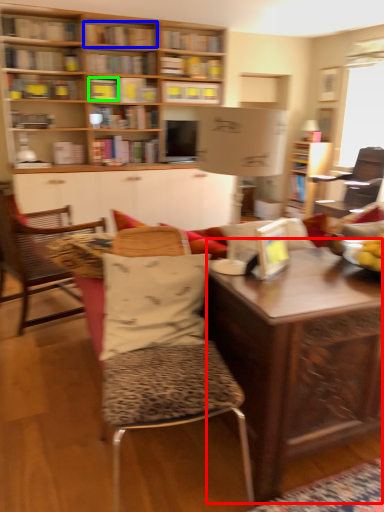
Question: Based on their relative distances, which object is nearer to desk (highlighted by a red box)? Choose from book (highlighted by a blue box) and book (highlighted by a green box).

Choices:
 (A) book
 (B) book

Answer: (B)